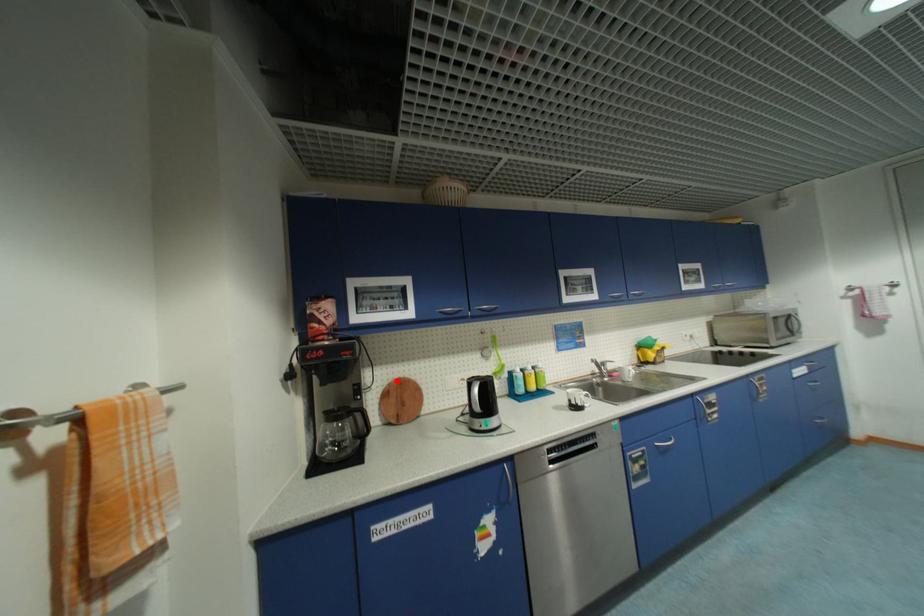
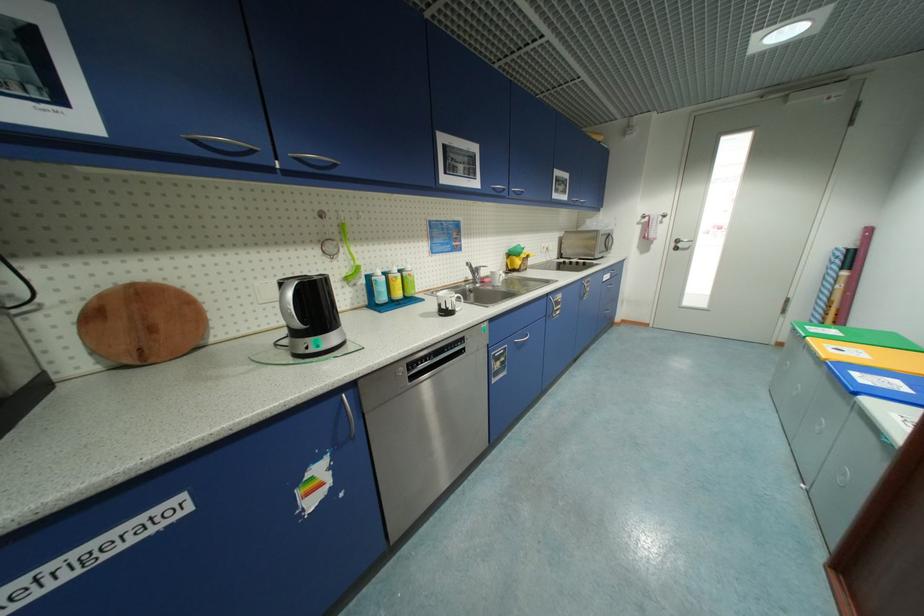
Find the pixel in the second image that matches the highlighted location in the first image.

(114, 286)